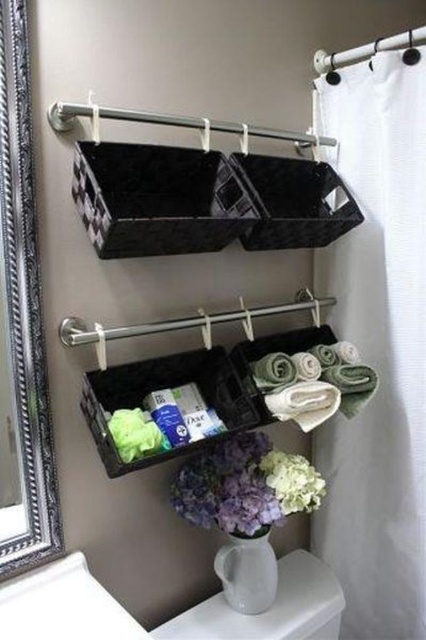
Who is higher up, silver ornate mirror at left or translucent plastic organizer at center?

silver ornate mirror at left is higher up.

Does point (26, 408) come in front of point (149, 387)?

Yes, it is in front of point (149, 387).

You are a GUI agent. You are given a task and a screenshot of the screen. Output one action in this format:
    pyautogui.click(x=<x>, y=<y>)
    Task: Click on the silver ornate mirror at left
    
    Given the screenshot: What is the action you would take?
    pyautogui.click(x=25, y=301)

Who is higher up, white fabric curtain at right or silver ornate mirror at left?

Positioned higher is silver ornate mirror at left.

In the scene shown: Can you confirm if white fabric curtain at right is positioned to the right of silver ornate mirror at left?

Correct, you'll find white fabric curtain at right to the right of silver ornate mirror at left.

This screenshot has width=426, height=640. I want to click on white fabric curtain at right, so click(377, 346).

Is point (256, 634) positioned in front of point (129, 413)?

No, it is not.

Is white glossy toilet bowl at lower center shorter than green fuzzy flower at lower center?

Incorrect, white glossy toilet bowl at lower center's height does not fall short of green fuzzy flower at lower center's.

Identify the location of white glossy toilet bowl at lower center. (270, 609).